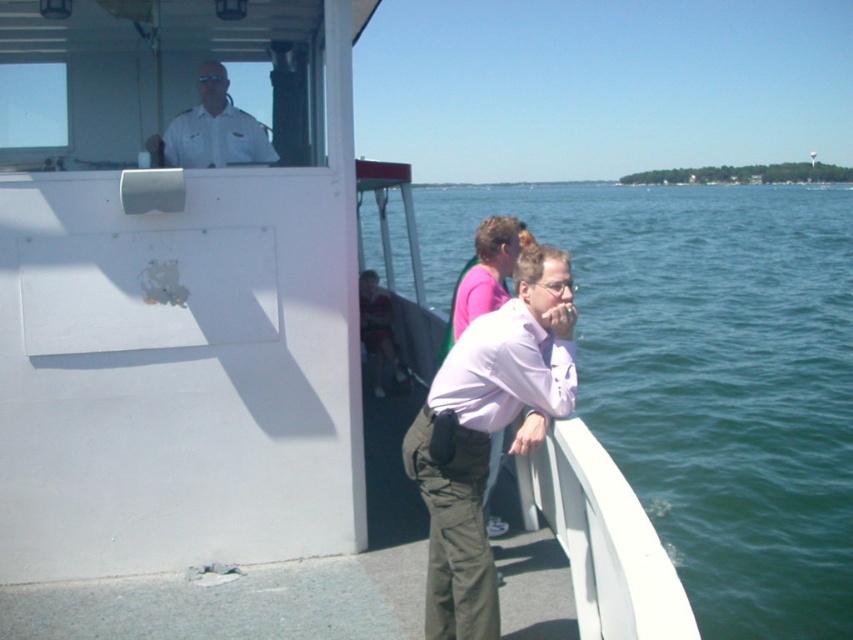
You are on a boat deck and want to know which object is higher between the green water at right and the light purple shirt at center. Can you determine which one is taller?

The green water at right is much taller than the light purple shirt at center.

You are a photographer on the boat and want to capture a wide shot of the scene. Since the green water at right and light purple shirt at center are both in your frame, which one appears wider in the photo?

The green water at right appears wider than the light purple shirt at center because its width surpasses the shirt.

You are a photographer trying to capture the entire scene of the green water at right and the white uniform at upper center in one shot. Which object should you focus on first to ensure both are in frame, considering their sizes?

The green water at right is wider than the white uniform at upper center, so you should focus on the green water at right first to ensure both are in frame.